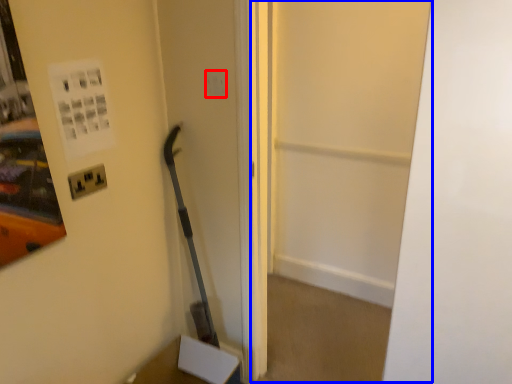
Question: Which object is closer to the camera taking this photo, light switch (highlighted by a red box) or glass door (highlighted by a blue box)?

Choices:
 (A) light switch
 (B) glass door

Answer: (B)